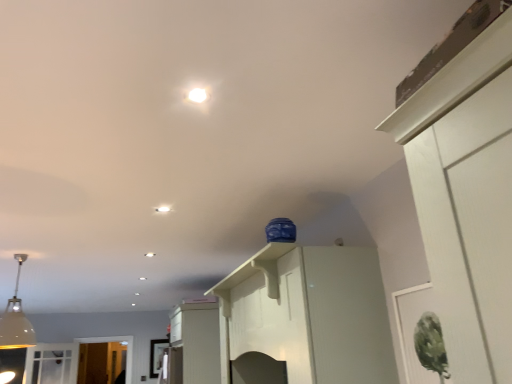
Question: From the image's perspective, relative to white glossy cabinet at center, the 2th cabinetry from the right, is white matte pendant light at left above or below?

Choices:
 (A) above
 (B) below

Answer: (A)

Question: Considering their positions, is white matte pendant light at left located in front of or behind white glossy cabinet at center, the 2th cabinetry from the right?

Choices:
 (A) front
 (B) behind

Answer: (A)

Question: Which object is positioned closest to the white glossy light fixture at upper center?

Choices:
 (A) white matte pendant light at left
 (B) white glossy cabinet at upper center, marked as the 2th cabinetry in a left-to-right arrangement
 (C) white glossy light fixture at center
 (D) white glossy cabinet at center, which is the 1th cabinetry in back-to-front order

Answer: (C)

Question: Based on their relative distances, which object is nearer to the white glossy cabinet at upper center, which is counted as the 1th cabinetry, starting from the top?

Choices:
 (A) white glossy cabinet at center, the 2th cabinetry in the top-to-bottom sequence
 (B) white glossy light fixture at center
 (C) white glossy light fixture at upper center
 (D) white matte pendant light at left

Answer: (B)